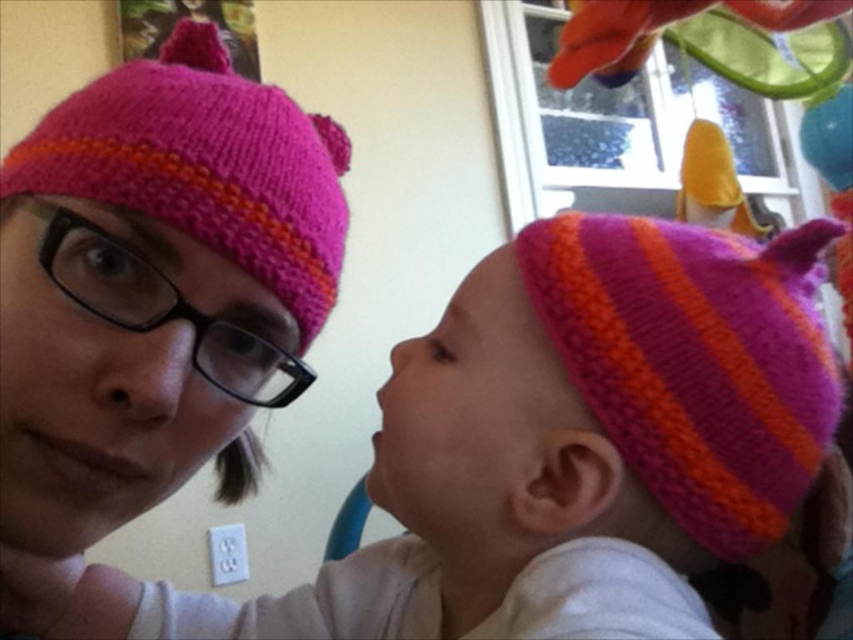
You are a photographer trying to capture a candid shot of the two people in the image. You need to ensure that both the matte pink knit hat at upper left and the matte knitted hat at center are in focus. Given that your camera has a depth of field that can cover 8 inches, will both hats be in focus?

The distance between the matte pink knit hat at upper left and the matte knitted hat at center is 7.89 inches, which is within the camera depth of field of 8 inches. Therefore, both hats will be in focus.

You are holding a 12 inch ruler and want to measure the distance from the camera to the point at coordinates (643, 371). Can your ruler reach that distance?

The point at coordinates (643, 371) is 14.27 inches from the camera. Since your ruler is only 12 inches long, it cannot reach that distance.

You are standing in front of the image and want to determine which of the two points, point (646, 314) or point (57, 496), is closer to you. Based on the scene, which point is nearer?

Point (646, 314) is further to the viewer than point (57, 496). Wait, the description says the opposite. Let me check again. The Objects Description states that point (646, 314) is further to the viewer than point (57, 496). Therefore, the closer point to you would be point (57, 496) since it is nearer compared to the other point which is further away.